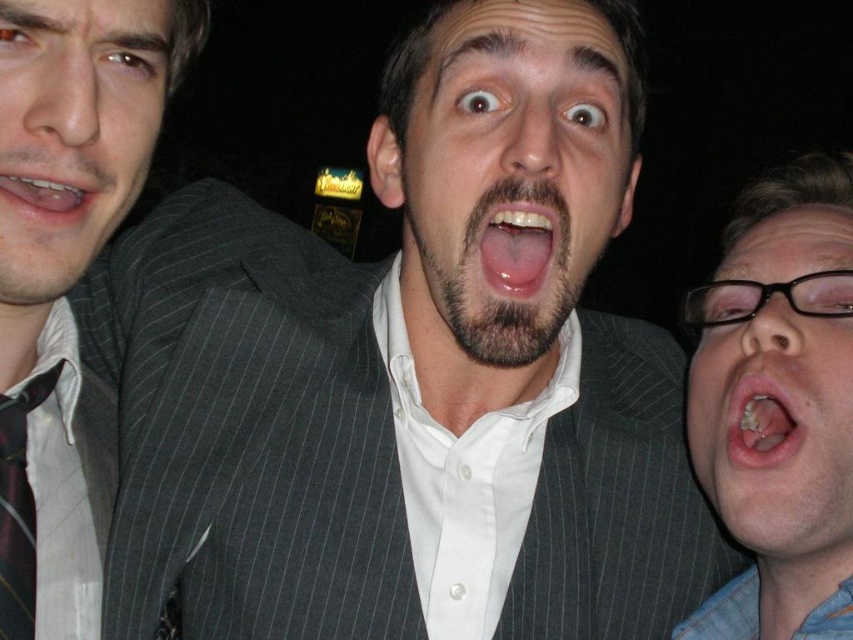
Question: Is maroon striped tie at left smaller than matte black teeth at center?

Choices:
 (A) yes
 (B) no

Answer: (B)

Question: Does matte black glasses at right appear over matte black suit at left?

Choices:
 (A) no
 (B) yes

Answer: (A)

Question: Which point appears farthest from the camera in this image?

Choices:
 (A) (15, 428)
 (B) (128, 196)

Answer: (B)

Question: Which is farther from the pinstriped suit at center?

Choices:
 (A) matte gray suit at center
 (B) pink glossy lips at center
 (C) matte black glasses at right

Answer: (B)

Question: From the image, what is the correct spatial relationship of pinstriped suit at center in relation to matte black teeth at center?

Choices:
 (A) below
 (B) above

Answer: (A)

Question: Which object is farther from the camera taking this photo?

Choices:
 (A) matte black glasses at right
 (B) matte black teeth at center

Answer: (A)